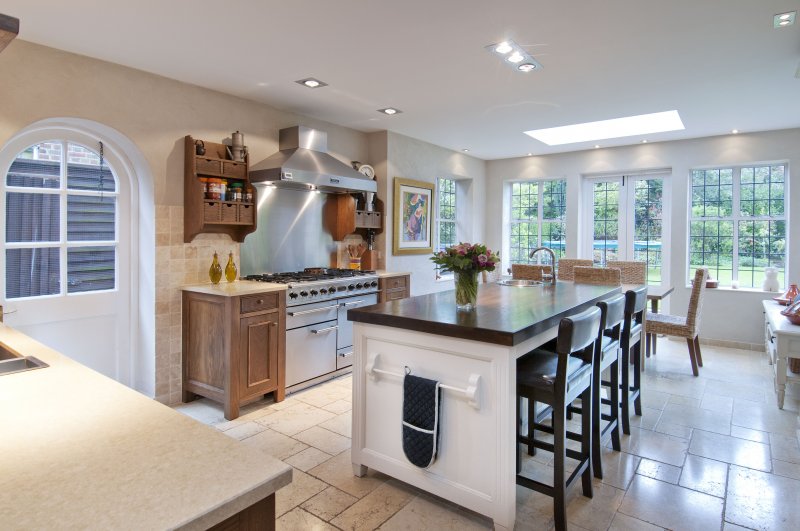
Locate an element on the screen. The image size is (800, 531). kitchen island is located at coordinates (498, 321).